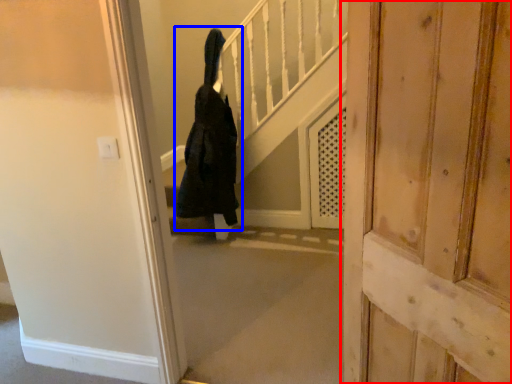
Question: Which object appears farthest to the camera in this image, door (highlighted by a red box) or person (highlighted by a blue box)?

Choices:
 (A) door
 (B) person

Answer: (B)